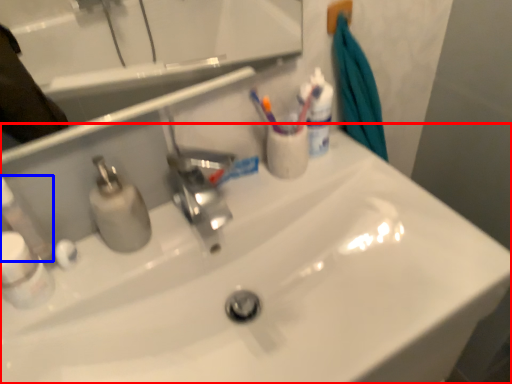
Question: Which object appears farthest to the camera in this image, sink (highlighted by a red box) or toiletry (highlighted by a blue box)?

Choices:
 (A) sink
 (B) toiletry

Answer: (B)